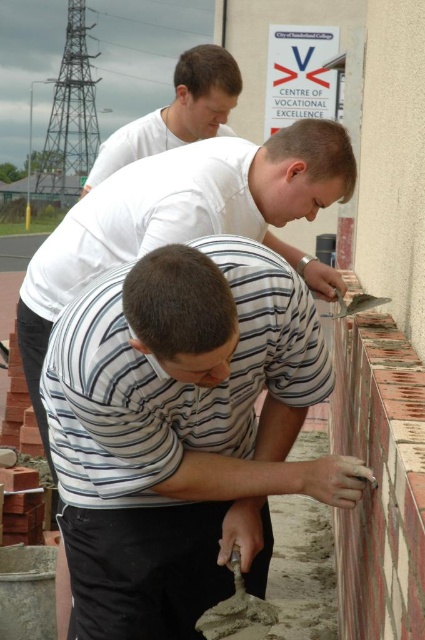
You are a safety inspector at the City of Sunderland College Centre of Vocational Excellence. You need to ensure that workers maintain a safe distance of at least 1.5 meters apart during bricklaying activities. Based on the image provided, is the distance between the white striped shirt at center and the rustic clay bricks at right compliant with the safety guidelines?

The distance between the white striped shirt at center and the rustic clay bricks at right is 1.29 meters, which is less than the required 1.5 meters. Therefore, the current distance does not comply with the safety guidelines.

You are standing in front of the bricklaying scene at the Sunderland College. There are two points marked in the image, one at coordinates point (285, 186) and another at point (212, 125). Which point is closer to you?

Point (285, 186) is closer to the viewer than point (212, 125).